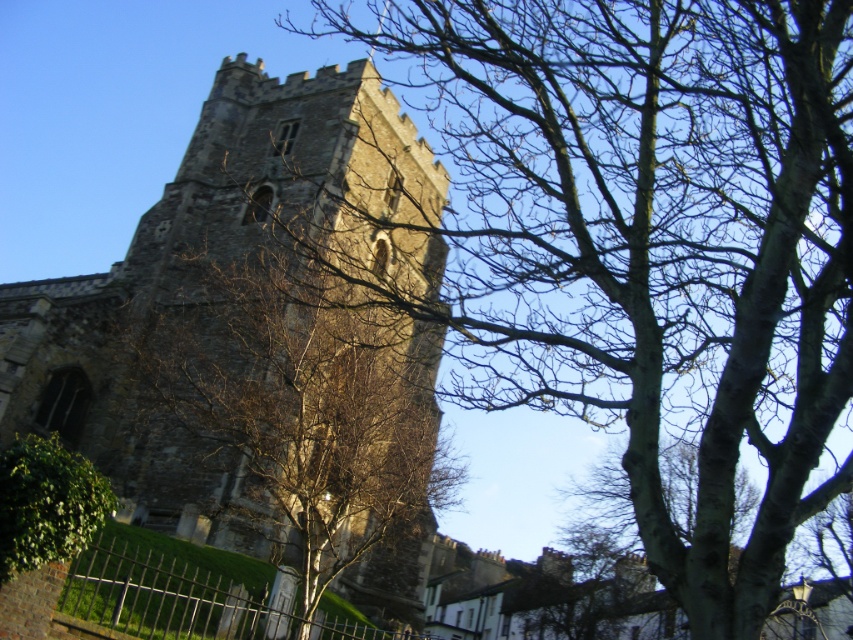
Between point (714, 148) and point (33, 552), which one is positioned behind?

The point (714, 148) is behind.

Does brown bark tree at center have a smaller size compared to green leafy bush at lower left?

Actually, brown bark tree at center might be larger than green leafy bush at lower left.

The width and height of the screenshot is (853, 640). In order to click on brown bark tree at center in this screenshot , I will do `click(653, 244)`.

Is gray stone tower at center smaller than green leafy bush at lower left?

Actually, gray stone tower at center might be larger than green leafy bush at lower left.

Is point (376, 164) farther from viewer compared to point (3, 545)?

Yes.

Where is `gray stone tower at center`? gray stone tower at center is located at coordinates (219, 268).

Does brown bark tree at center appear on the left side of gray stone tower at center?

No, brown bark tree at center is not to the left of gray stone tower at center.

Who is positioned more to the right, brown bark tree at center or gray stone tower at center?

brown bark tree at center is more to the right.

Image resolution: width=853 pixels, height=640 pixels. What do you see at coordinates (653, 244) in the screenshot?
I see `brown bark tree at center` at bounding box center [653, 244].

Locate an element on the screen. brown bark tree at center is located at coordinates (653, 244).